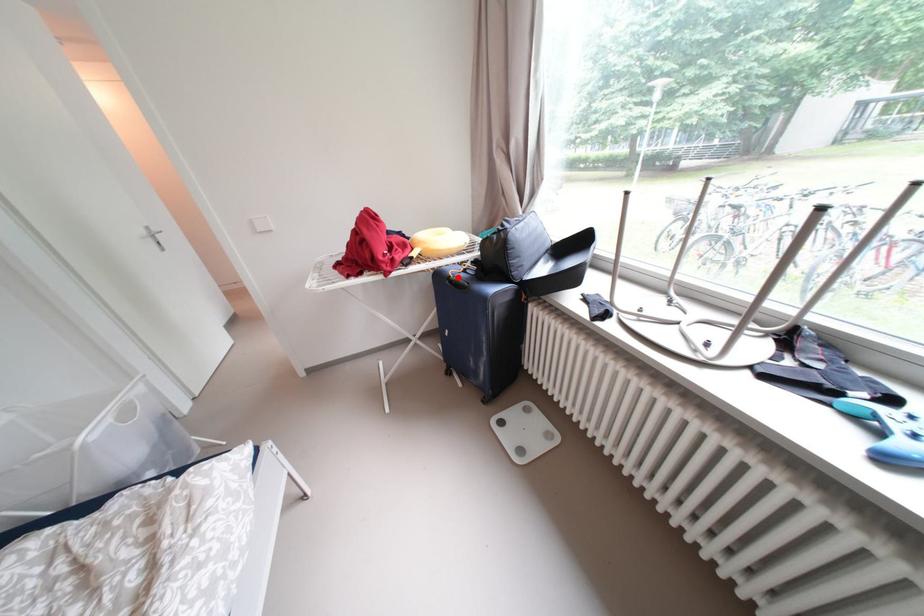
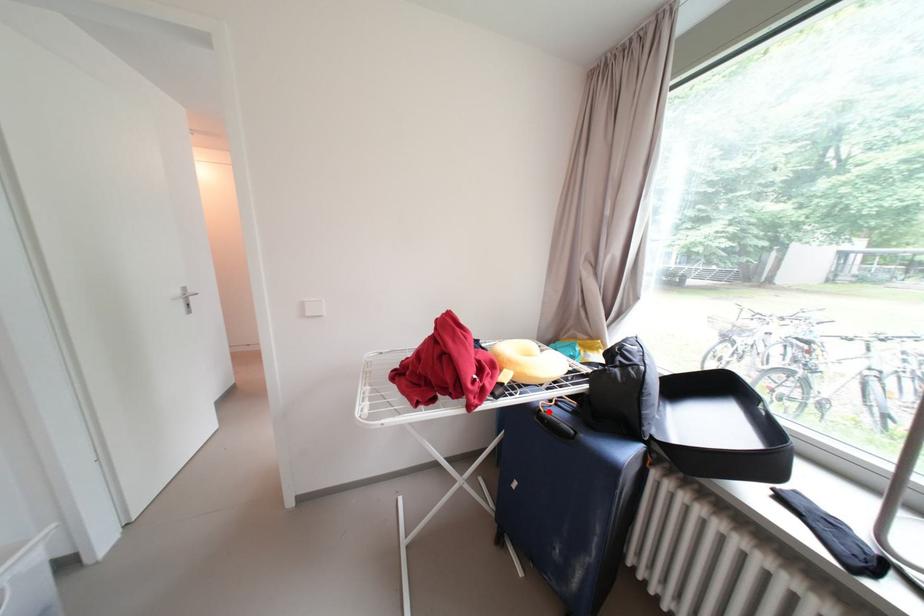
I am providing you with two images of the same scene from different viewpoints. A red point is marked on the first image and another point is marked on the second image. Are the points marked in image1 and image2 representing the same 3D position?

Yes